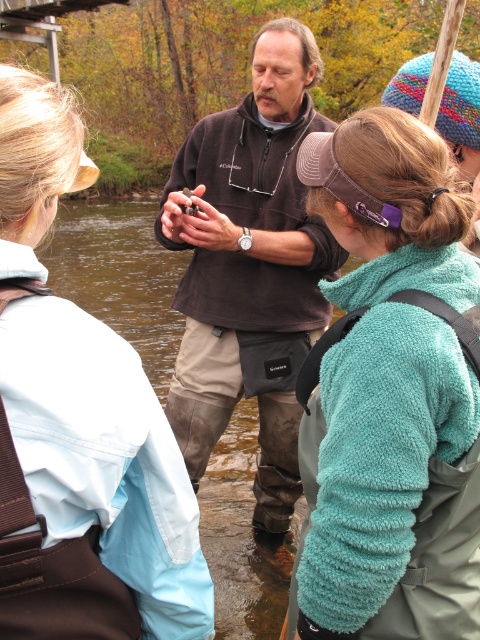
How distant is teal fleece jacket at center from brown soft sweater at center?

teal fleece jacket at center is 4.32 feet away from brown soft sweater at center.

Does teal fleece jacket at center have a lesser height compared to brown soft sweater at center?

Yes.

Is point (391, 566) in front of point (248, 102)?

Yes, it is.

Find the location of a particular element. The height and width of the screenshot is (640, 480). teal fleece jacket at center is located at coordinates (392, 394).

Can you confirm if light blue waterproof jacket at upper left is smaller than brown soft sweater at center?

Indeed, light blue waterproof jacket at upper left has a smaller size compared to brown soft sweater at center.

Does light blue waterproof jacket at upper left have a greater width compared to brown soft sweater at center?

Incorrect, light blue waterproof jacket at upper left's width does not surpass brown soft sweater at center's.

Find the location of a particular element. The height and width of the screenshot is (640, 480). light blue waterproof jacket at upper left is located at coordinates (80, 426).

Find the location of a particular element. Image resolution: width=480 pixels, height=640 pixels. light blue waterproof jacket at upper left is located at coordinates (80, 426).

Can you confirm if teal fleece jacket at center is positioned below light blue waterproof jacket at upper left?

Yes.

Is teal fleece jacket at center positioned at the back of light blue waterproof jacket at upper left?

That is True.

Does point (367, 584) come behind point (37, 172)?

That is True.

Locate an element on the screen. The image size is (480, 640). teal fleece jacket at center is located at coordinates 392,394.